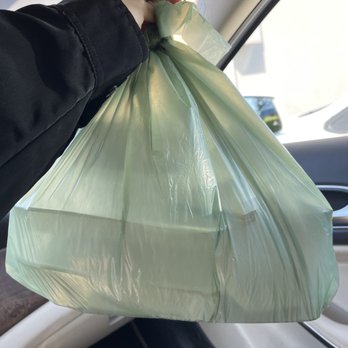
The width and height of the screenshot is (348, 348). Find the location of `window`. window is located at coordinates [307, 89].